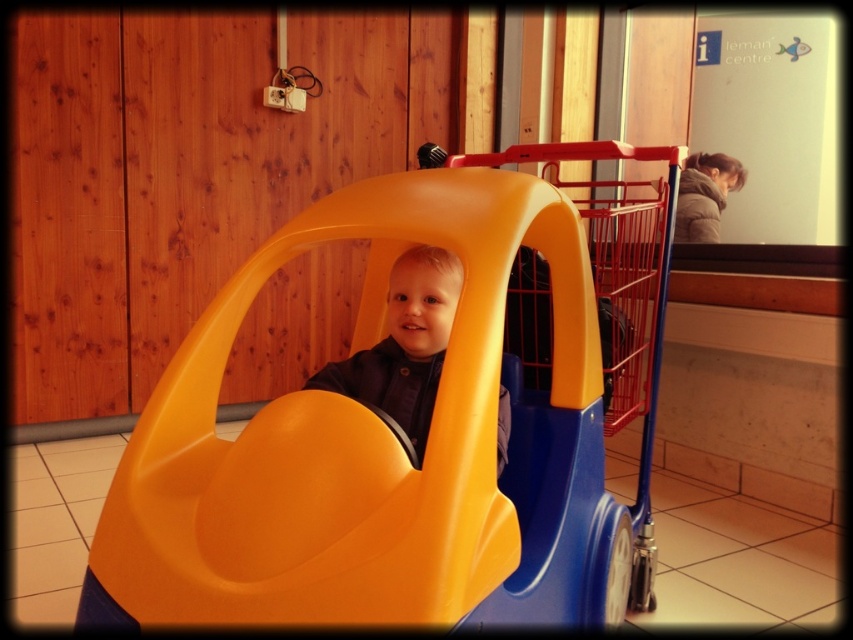
You are designing a new toy car that needs to accommodate a child exactly like the matte plastic boy at center. Based on the scene, will the matte plastic car at center be wide enough for the child? Explain your reasoning.

The matte plastic car at center is wider than the matte plastic boy at center, so it should be wide enough to accommodate the child.

Looking at this image, you are standing at point A located at coordinates (614, 294). What object is exactly at your current location?

The yellow plastic toy car at center is exactly at point A located at coordinates (614, 294).

You are a parent trying to ensure your child stays safe in the shopping cart. The matte plastic car at center and the matte plastic boy at center are part of the toy car setup. Which object is located directly beneath the other?

The matte plastic car at center is positioned under the matte plastic boy at center, meaning the boy is sitting on top of the car.